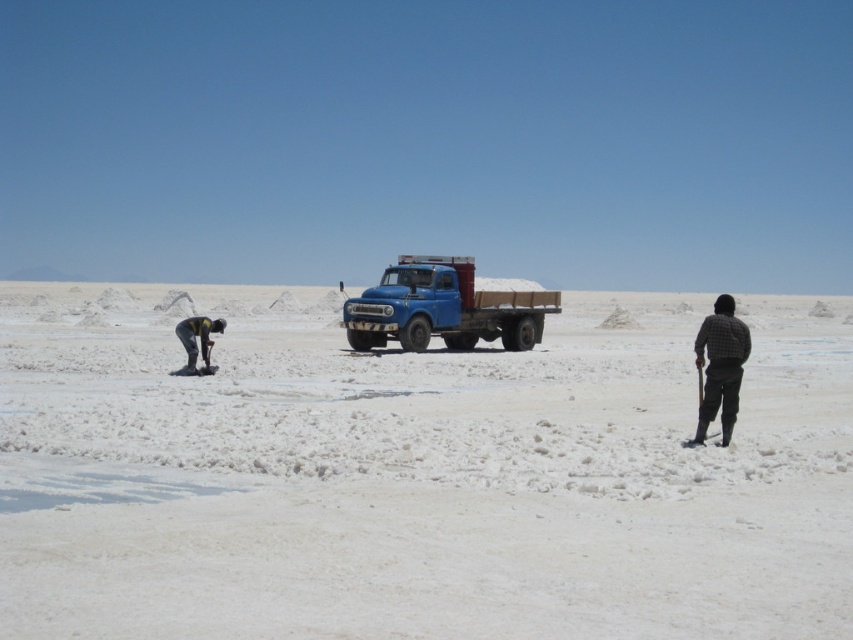
You are standing on the white sandy desert at center and looking towards the plaid fabric shirt at right. Which object appears bigger in your view?

The white sandy desert at center appears larger than the plaid fabric shirt at right in your view.

Based on the photo, you are standing on the white sandy desert at center and want to reach the blue matte truck at center. According to the scene description, which direction should you move in to get there?

The white sandy desert at center is to the right of the blue matte truck at center, so you should move to the left to reach the truck.

You are planning to drive a car that is 5 meters long through the white sandy desert at center and the blue matte truck at center. Which area can accommodate your car without any issues?

The white sandy desert at center is bigger than the blue matte truck at center, so the car can fit in the white sandy desert at center since it has more space.